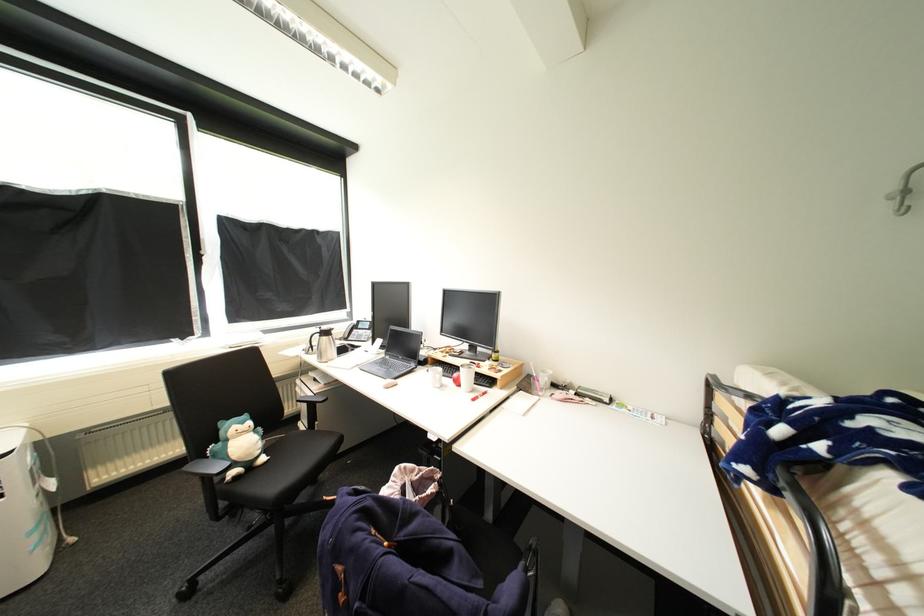
Where would you lift the carafe handle? Please return your answer as a coordinate pair (x, y).

(435, 377)